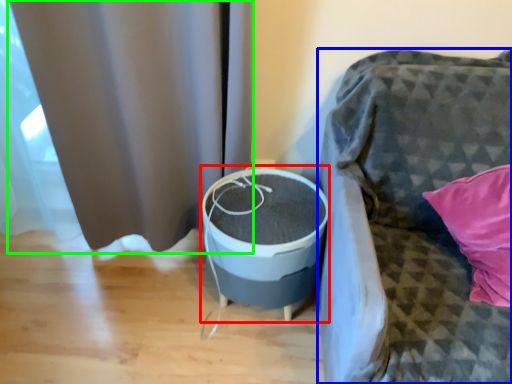
Question: Which is nearer to the round table (highlighted by a red box)? furniture (highlighted by a blue box) or curtain (highlighted by a green box).

Choices:
 (A) furniture
 (B) curtain

Answer: (A)